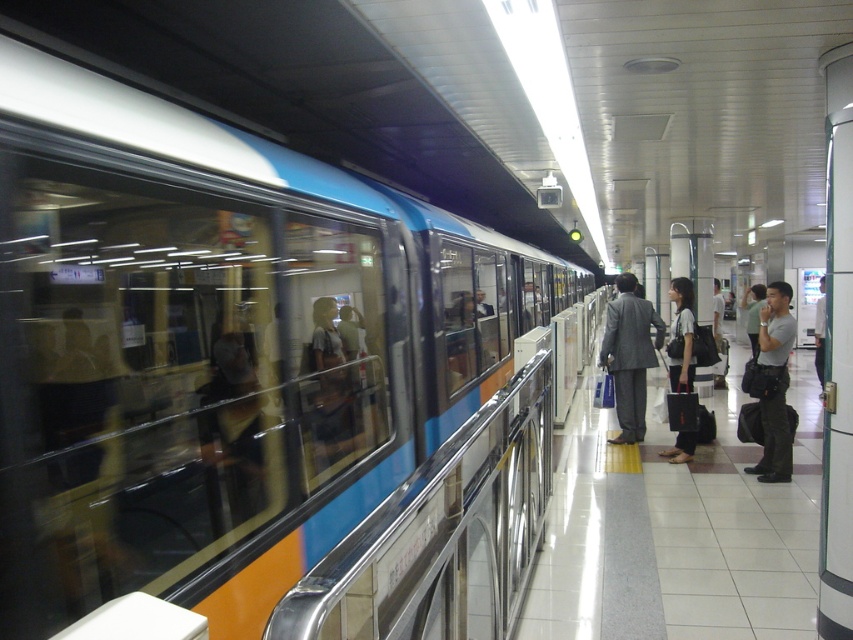
Between matte gray suit at center and gray fabric bag at right, which one appears on the left side from the viewer's perspective?

matte gray suit at center

Which is more to the right, matte gray suit at center or gray fabric bag at right?

Positioned to the right is gray fabric bag at right.

Between point (631, 352) and point (781, 424), which one is positioned behind?

Positioned behind is point (631, 352).

At what (x,y) coordinates should I click in order to perform the action: click on matte gray suit at center. Please return your answer as a coordinate pair (x, y). This screenshot has width=853, height=640. Looking at the image, I should click on (630, 355).

Looking at this image, does gray fabric bag at right appear on the left side of matte black bag at center?

Incorrect, gray fabric bag at right is not on the left side of matte black bag at center.

Does gray fabric bag at right lie in front of matte black bag at center?

That is True.

What do you see at coordinates (773, 384) in the screenshot? I see `gray fabric bag at right` at bounding box center [773, 384].

The height and width of the screenshot is (640, 853). Find the location of `gray fabric bag at right`. gray fabric bag at right is located at coordinates (773, 384).

Can you confirm if matte gray suit at center is smaller than matte black bag at center?

No, matte gray suit at center is not smaller than matte black bag at center.

Is matte gray suit at center above matte black bag at center?

No.

Describe the element at coordinates (630, 355) in the screenshot. The image size is (853, 640). I see `matte gray suit at center` at that location.

Find the location of a particular element. matte gray suit at center is located at coordinates (630, 355).